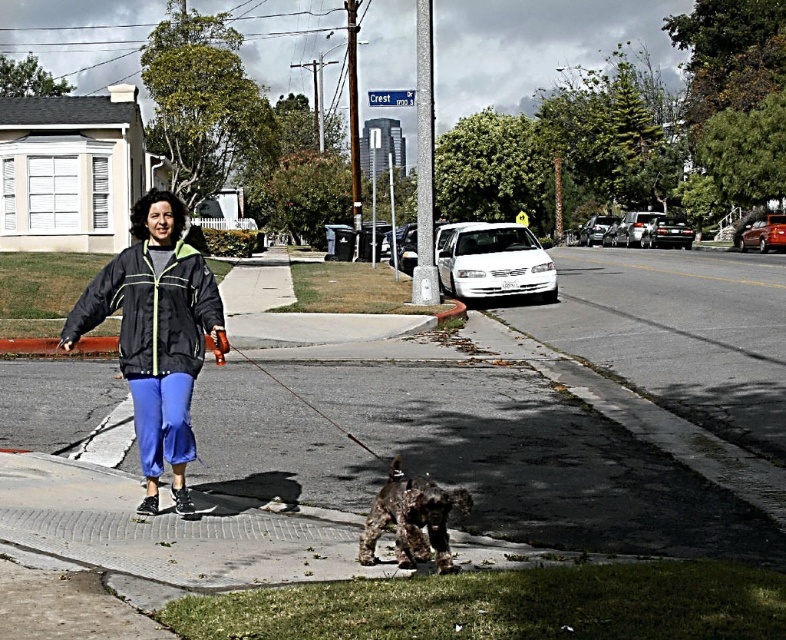
Between matte black jacket at center and shaggy brown dog at center, which one is positioned lower?

shaggy brown dog at center is lower down.

Can you confirm if matte black jacket at center is smaller than shaggy brown dog at center?

Incorrect, matte black jacket at center is not smaller in size than shaggy brown dog at center.

Is point (140, 410) behind point (406, 504)?

Yes, it is behind point (406, 504).

Identify the location of matte black jacket at center. (156, 336).

Who is taller, matte black jacket at center or smooth black leash at center?

matte black jacket at center is taller.

Identify the location of matte black jacket at center. The width and height of the screenshot is (786, 640). (156, 336).

Can you confirm if gray concrete sidewalk at center is positioned below smooth black leash at center?

Correct, gray concrete sidewalk at center is located below smooth black leash at center.

Does gray concrete sidewalk at center have a greater height compared to smooth black leash at center?

In fact, gray concrete sidewalk at center may be shorter than smooth black leash at center.

The image size is (786, 640). What do you see at coordinates (537, 461) in the screenshot? I see `gray concrete sidewalk at center` at bounding box center [537, 461].

Find the location of a particular element. The image size is (786, 640). gray concrete sidewalk at center is located at coordinates (537, 461).